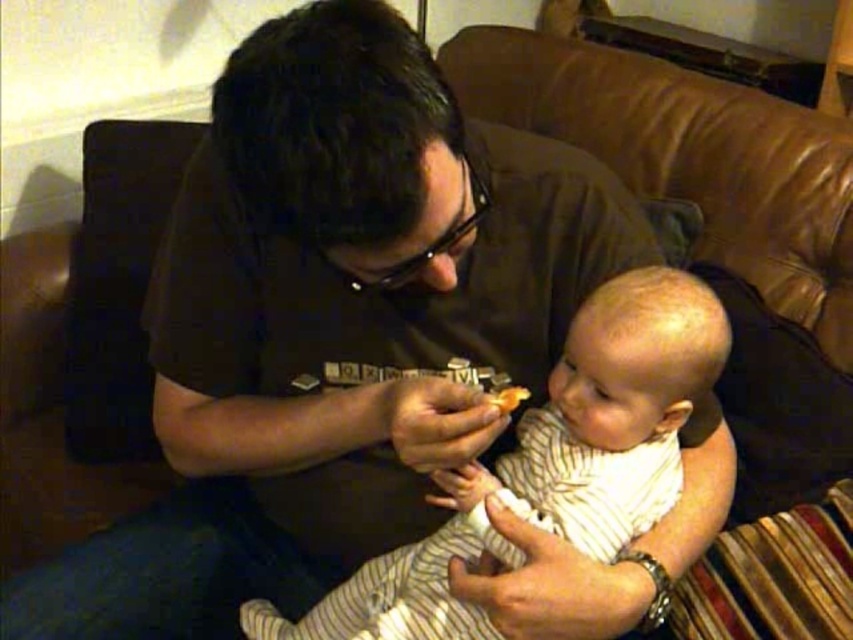
Looking at this image, you are a parent holding a baby in a striped cotton onesie at center and a yellow matte cookie at center. The baby is reaching for the cookie. Can you safely hand the cookie to the baby without dropping it?

The striped cotton onesie at center is positioned under yellow matte cookie at center, so you can safely hand the cookie to the baby by moving the yellow matte cookie at center downward towards the baby in the striped cotton onesie at center without dropping it.

You are a parent trying to decide whether to place the yellow matte cookie at center on the striped cotton onesie at center. Considering their sizes, will the cookie fit without overlapping the edges?

The striped cotton onesie at center is wider than the yellow matte cookie at center, so the cookie can fit on the onesie without overlapping the edges.

You are a photographer trying to capture a closeup of the yellow matte cookie at center while ensuring the striped cotton onesie at center remains visible in the background. Can you adjust your camera position to achieve this without moving any objects?

The striped cotton onesie at center is closer to the viewer than the yellow matte cookie at center. By moving the camera closer to the cookie and focusing on it, the onesie will still be visible but slightly blurred in the background, fulfilling the requirement without moving objects.